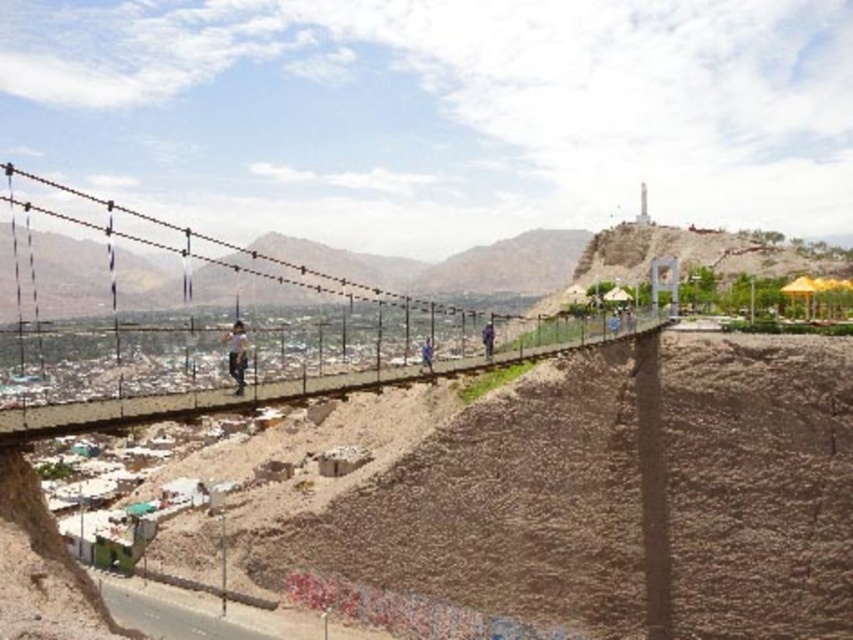
Question: Which point is farther to the camera?

Choices:
 (A) (672, 548)
 (B) (489, 340)
 (C) (424, 353)

Answer: (A)

Question: Can you confirm if blue fabric person at center is positioned above dark blue jeans at center?

Choices:
 (A) no
 (B) yes

Answer: (A)

Question: Estimate the real-world distances between objects in this image. Which object is closer to the blue fabric person at center?

Choices:
 (A) brown sandy dirt track at center
 (B) light brown wooden stick at center
 (C) dark blue jeans at center

Answer: (C)

Question: Is the position of brown sandy dirt track at center more distant than that of blue fabric person at center?

Choices:
 (A) no
 (B) yes

Answer: (A)

Question: Is light brown wooden stick at center thinner than blue fabric person at center?

Choices:
 (A) no
 (B) yes

Answer: (A)

Question: Which object is the closest to the brown sandy dirt track at center?

Choices:
 (A) dark blue jeans at center
 (B) light brown wooden stick at center
 (C) blue fabric person at center

Answer: (A)